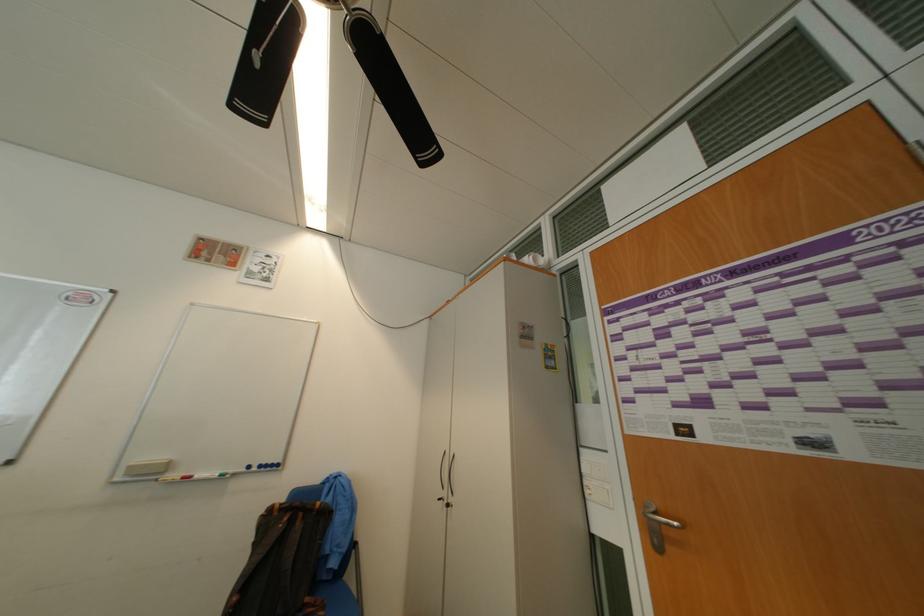
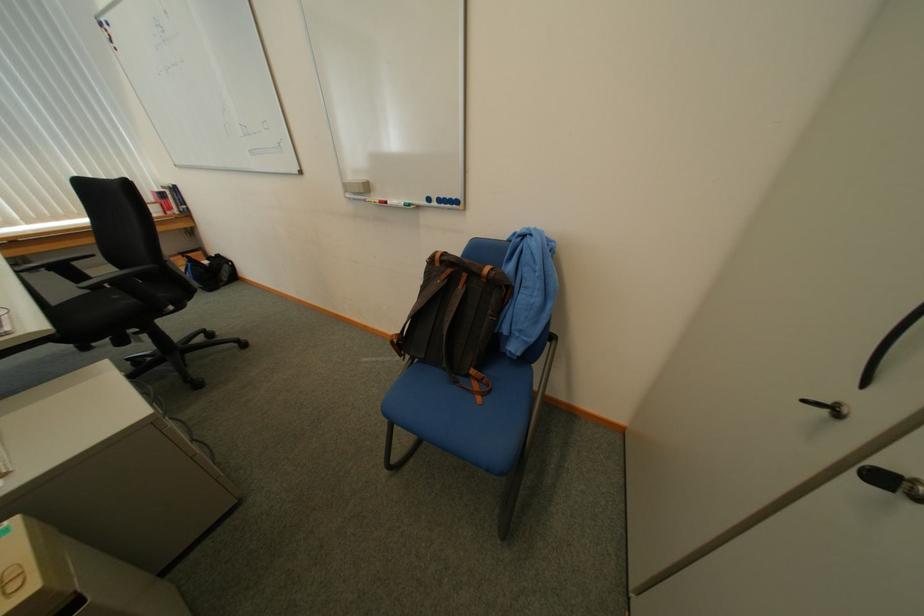
Find the pixel in the second image that matches [309,525] in the first image.

(469, 290)